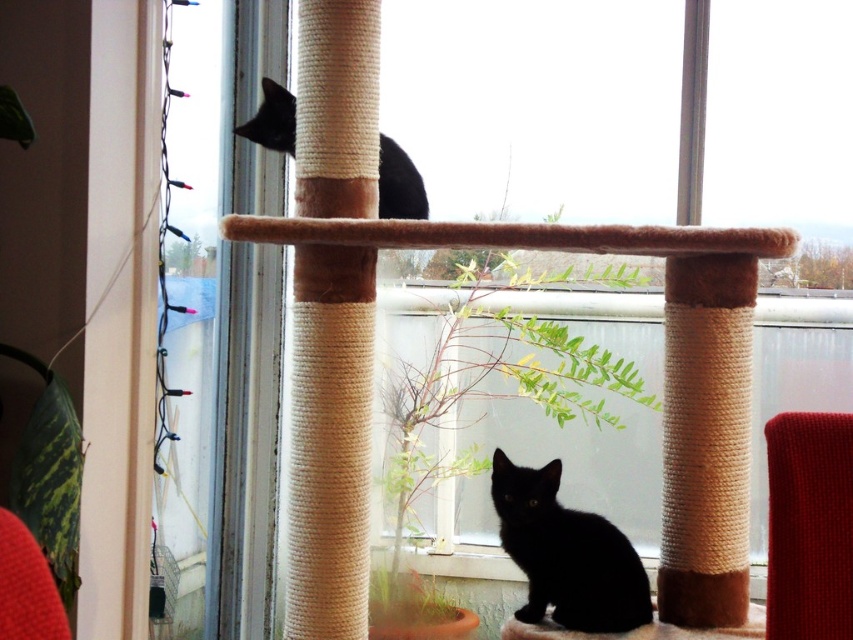
Question: Which point appears closest to the camera in this image?

Choices:
 (A) (404, 184)
 (B) (500, 525)

Answer: (B)

Question: Is matte black cat at lower center wider than black matte cat at upper left?

Choices:
 (A) yes
 (B) no

Answer: (B)

Question: Is matte black cat at lower center smaller than black matte cat at upper left?

Choices:
 (A) no
 (B) yes

Answer: (B)

Question: Is the position of matte black cat at lower center more distant than that of black matte cat at upper left?

Choices:
 (A) yes
 (B) no

Answer: (B)

Question: Which point is closer to the camera?

Choices:
 (A) black matte cat at upper left
 (B) matte black cat at lower center

Answer: (B)